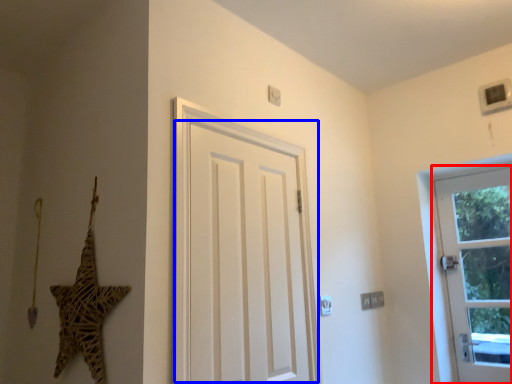
Question: Which object appears closest to the camera in this image, door (highlighted by a red box) or door (highlighted by a blue box)?

Choices:
 (A) door
 (B) door

Answer: (B)